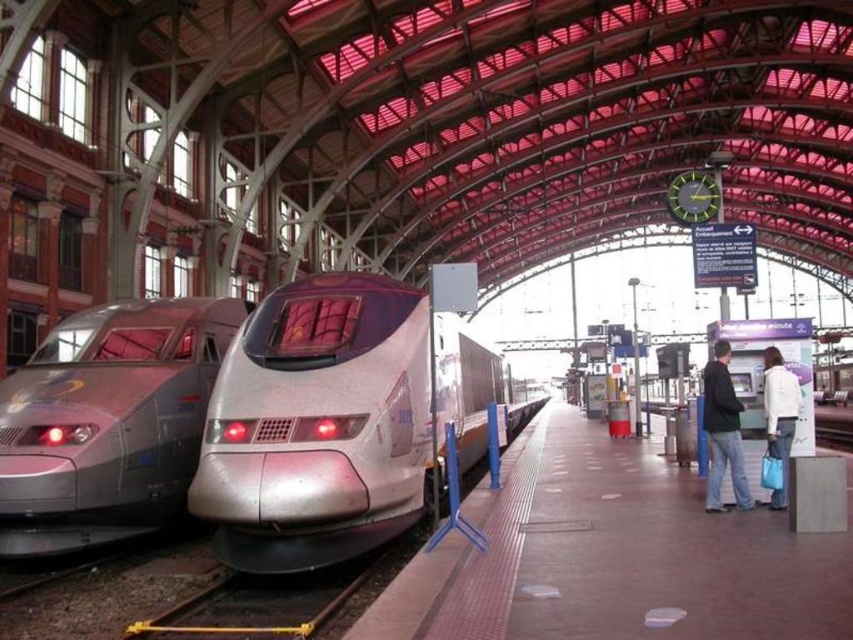
Question: From the image, what is the correct spatial relationship of brown smooth platform at center in relation to white fabric jacket at right?

Choices:
 (A) below
 (B) above

Answer: (A)

Question: Which object appears farthest from the camera in this image?

Choices:
 (A) brown smooth platform at center
 (B) sleek silver train at left
 (C) dark blue jeans at right
 (D) white fabric jacket at right

Answer: (C)

Question: Which object is positioned closest to the white fabric jacket at right?

Choices:
 (A) sleek silver train at center
 (B) sleek silver train at left
 (C) brown smooth platform at center

Answer: (C)

Question: Which point is farther to the camera?

Choices:
 (A) (740, 412)
 (B) (666, 566)
 (C) (180, 307)
 (D) (786, 378)

Answer: (C)

Question: Can you confirm if brown smooth platform at center is bigger than sleek silver train at left?

Choices:
 (A) no
 (B) yes

Answer: (A)

Question: Is brown smooth platform at center to the right of sleek silver train at left from the viewer's perspective?

Choices:
 (A) yes
 (B) no

Answer: (A)